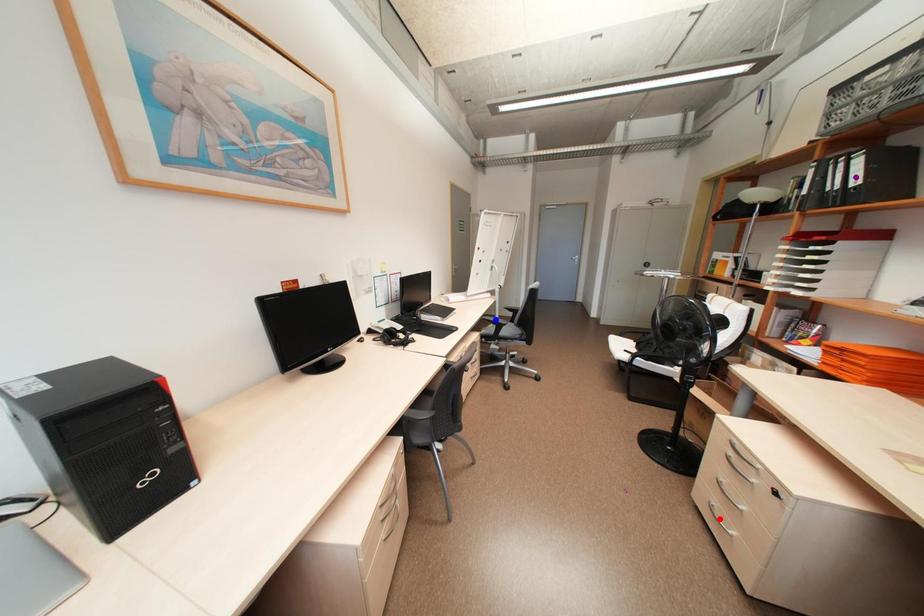
Order these from nearest to farthest:
red point, blue point, purple point

1. purple point
2. red point
3. blue point